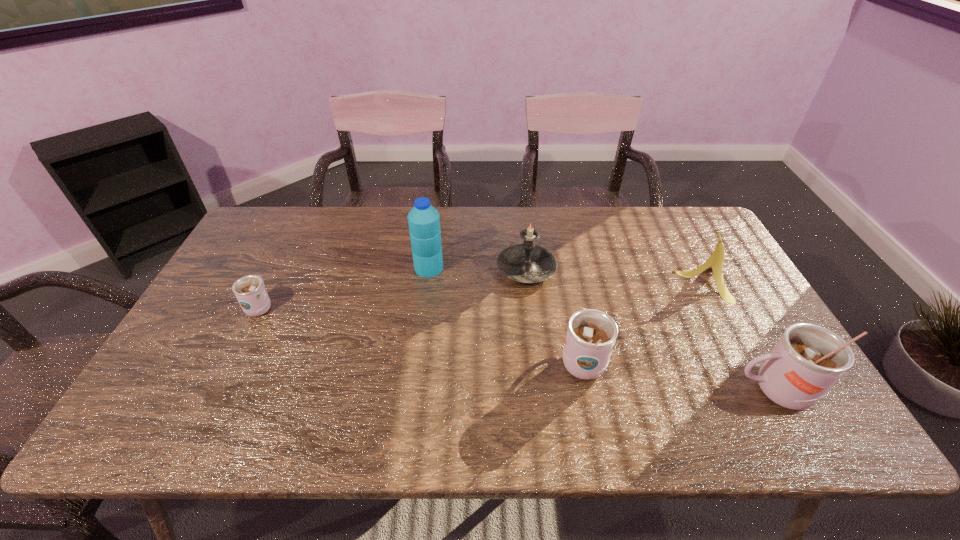
At what (x,y) coordinates should I click in order to perform the action: click on vacant area between the banana and the farthest cup. Please return your answer as a coordinate pair (x, y). Looking at the image, I should click on (482, 293).

Where is `free space between the fifth object from right to left and the candle`? Image resolution: width=960 pixels, height=540 pixels. free space between the fifth object from right to left and the candle is located at coordinates (478, 268).

Find the location of a particular element. vacant space that is in between the rightmost cup and the shortest cup is located at coordinates (517, 348).

Find the location of a particular element. This screenshot has height=540, width=960. vacant space that's between the banana and the rightmost cup is located at coordinates (739, 335).

Identify the location of free area in between the second shortest cup and the second object from left to right. This screenshot has width=960, height=540. (506, 313).

Identify the location of vacant space that's between the candle and the rightmost cup. tap(650, 329).

The image size is (960, 540). I want to click on blank region between the second shortest object and the second tallest cup, so click(643, 320).

Where is `free space that is in between the water bottle and the second shortest cup`? free space that is in between the water bottle and the second shortest cup is located at coordinates (x=506, y=313).

At what (x,y) coordinates should I click in order to perform the action: click on blank region between the candle and the second object from left to right. Please return your answer as a coordinate pair (x, y). This screenshot has height=540, width=960. Looking at the image, I should click on (478, 268).

Where is `the fifth closest object to the candle`? the fifth closest object to the candle is located at coordinates (250, 292).